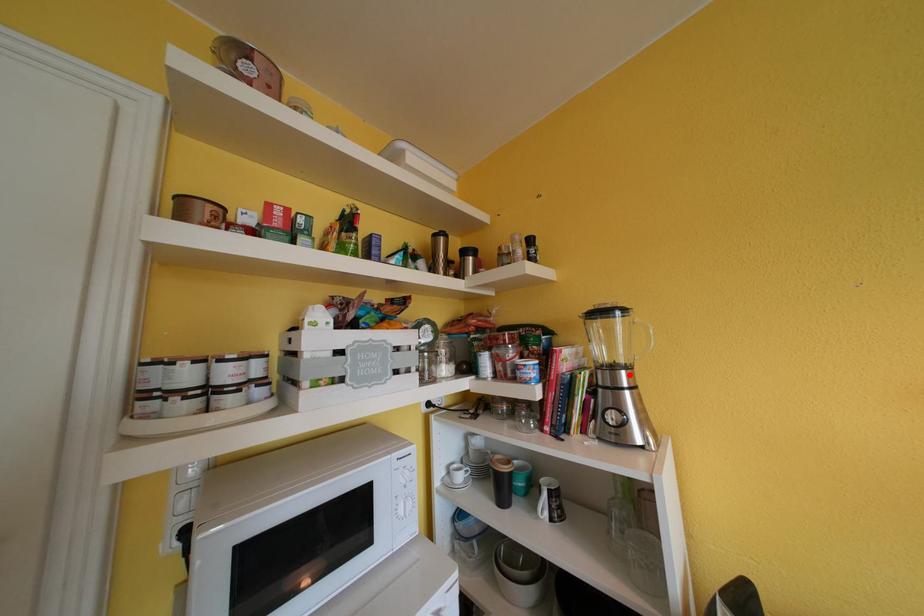
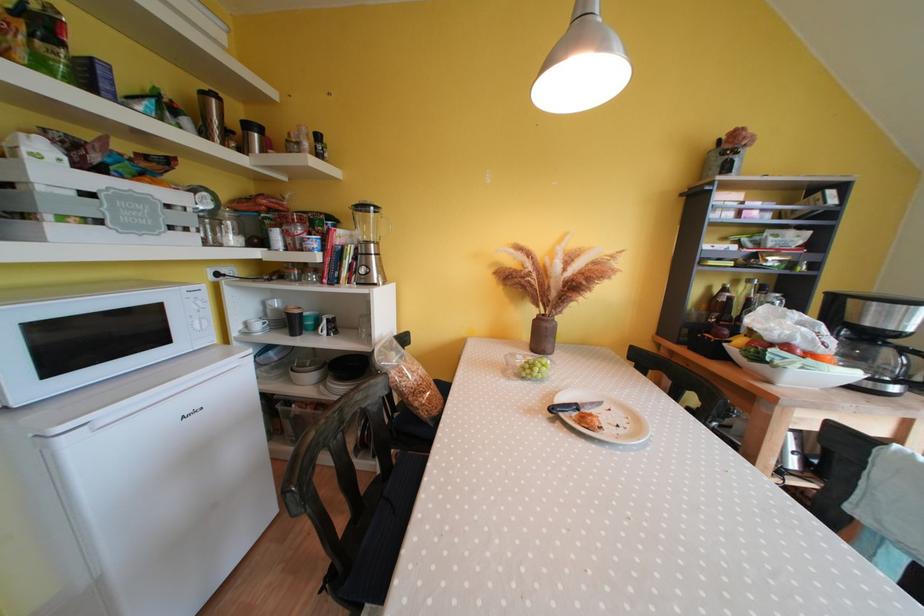
Find the pixel in the second image that matches the highlighted location in the first image.

(379, 249)